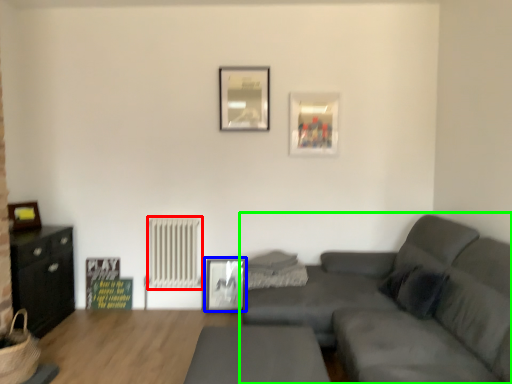
Question: Which object is the farthest from radiator (highlighted by a red box)? Choose among these: picture frame (highlighted by a blue box) or studio couch (highlighted by a green box).

Choices:
 (A) picture frame
 (B) studio couch

Answer: (B)